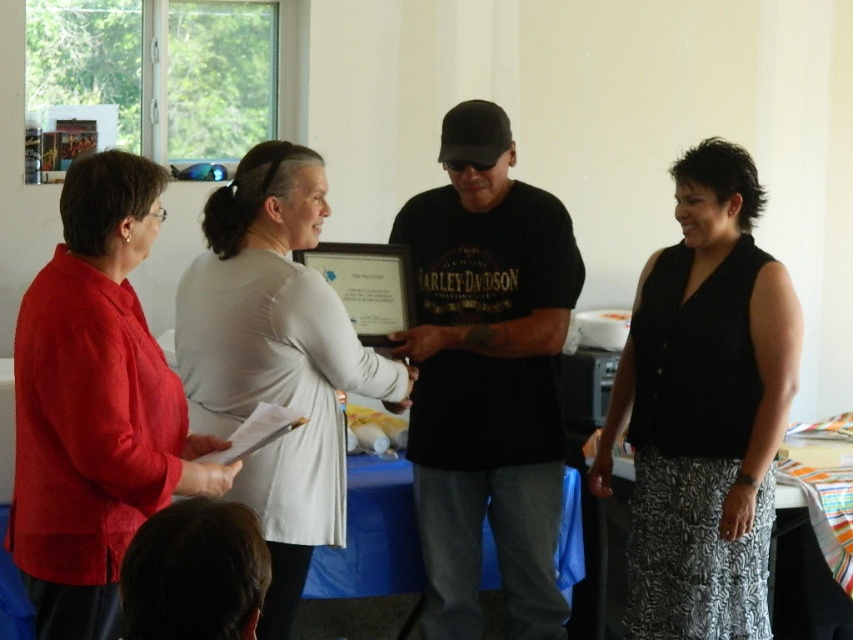
Question: Which point appears farthest from the camera in this image?

Choices:
 (A) (38, 408)
 (B) (234, 385)
 (C) (453, 252)
 (D) (752, 182)

Answer: (C)

Question: Which point is farther to the camera?

Choices:
 (A) (560, 339)
 (B) (115, 388)

Answer: (A)

Question: Does matte red blouse at left have a smaller size compared to blue fabric table at center?

Choices:
 (A) yes
 (B) no

Answer: (A)

Question: Observing the image, what is the correct spatial positioning of matte red blouse at left in reference to white fabric at center?

Choices:
 (A) left
 (B) right

Answer: (A)

Question: Which point is closer to the camera?

Choices:
 (A) black matte t-shirt at center
 (B) blue fabric table at center
 (C) white fabric at center

Answer: (C)

Question: Is black knit vest at right positioned behind matte red blouse at left?

Choices:
 (A) no
 (B) yes

Answer: (B)